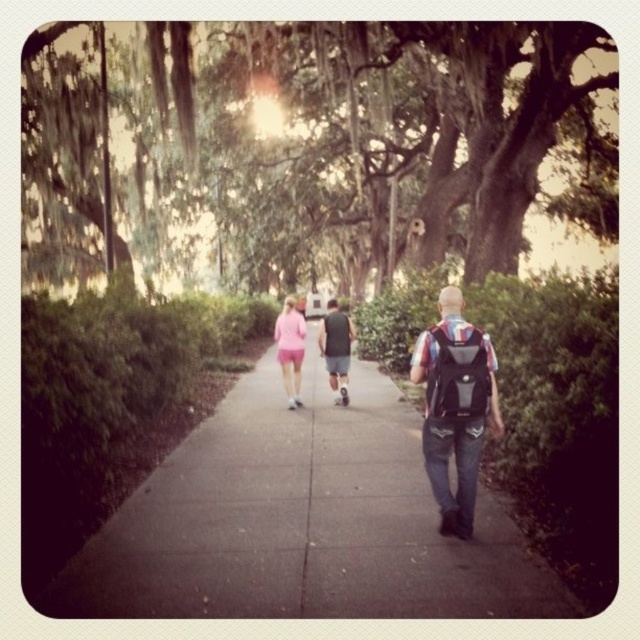
You are standing at the center of the paved pathway in the park. Looking around, you notice a point marked at coordinates (301, 522). What material is located at that specific point?

The material at point (301, 522) is concrete at center.

You are a hiker who just finished a trail and wants to place your items neatly on the ground. You have a black matte backpack at center and pink fabric shorts at center. Which item should you place first if you want to arrange them from smallest to largest?

The black matte backpack at center has a smaller size compared to pink fabric shorts at center, so you should place the black matte backpack at center first to arrange them from smallest to largest.